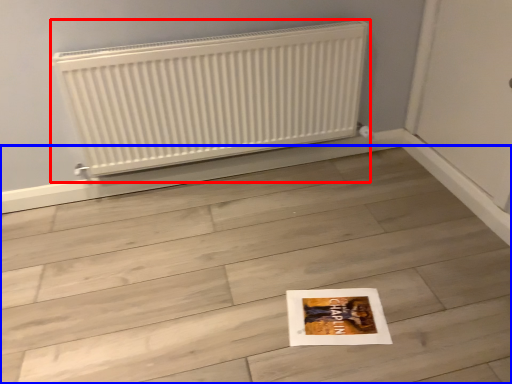
Question: Which object appears farthest to the camera in this image, radiator (highlighted by a red box) or tile (highlighted by a blue box)?

Choices:
 (A) radiator
 (B) tile

Answer: (A)